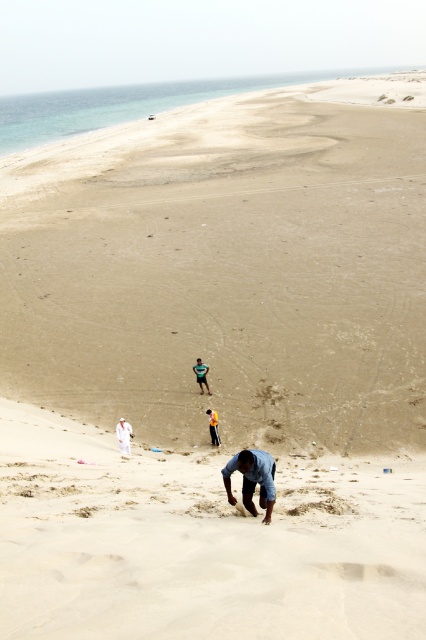
You are standing on the beach and see two points marked on the sand. The first point is at coordinates point [196,380] and the second is at point [212,440]. Which point is closer to you?

Point [196,380] is closer to you because it is further to the viewer than point [212,440].

You are standing on the beach and see the blue denim jeans at lower center and the white cotton shirt at center. Which clothing item is positioned more to the east?

The blue denim jeans at lower center are to the right of the white cotton shirt at center, so they are positioned more to the east.